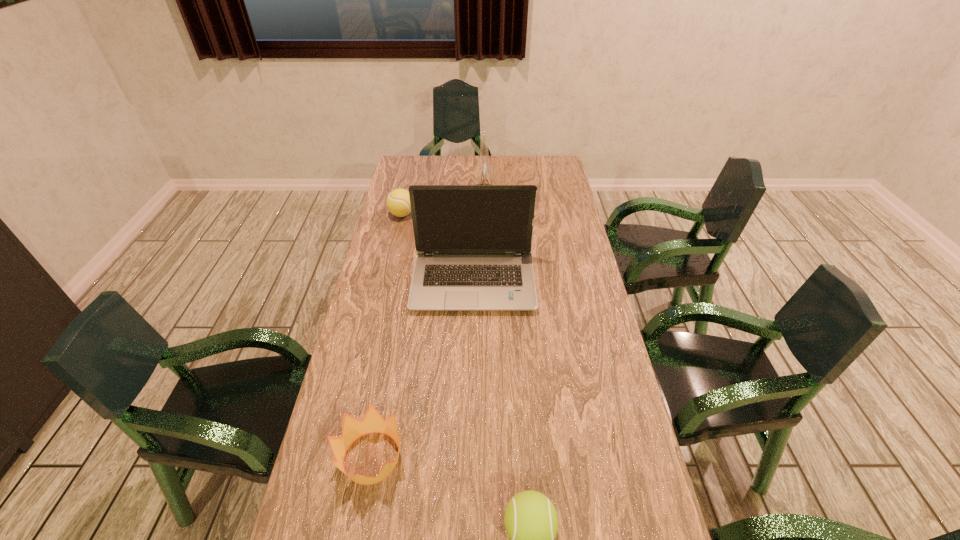
This screenshot has width=960, height=540. What are the coordinates of `oil lamp` in the screenshot? It's located at [x=484, y=174].

This screenshot has width=960, height=540. Find the location of `the third farthest object`. the third farthest object is located at coordinates (473, 242).

At what (x,y) coordinates should I click in order to perform the action: click on the left tennis ball. Please return your answer as a coordinate pair (x, y). Looking at the image, I should click on (398, 201).

At what (x,y) coordinates should I click in order to perform the action: click on crown. Please return your answer as a coordinate pair (x, y). This screenshot has height=540, width=960. Looking at the image, I should click on (352, 428).

Where is `vacant space located 0.270m on the right of the oil lamp`? vacant space located 0.270m on the right of the oil lamp is located at coordinates (566, 211).

Where is `free location located 0.120m on the screen of the third nearest object`? free location located 0.120m on the screen of the third nearest object is located at coordinates (472, 347).

Identify the location of free location located 0.300m on the right of the farther tennis ball. This screenshot has height=540, width=960. (493, 214).

Identify the location of free space located 0.070m on the right of the crown. (437, 458).

This screenshot has width=960, height=540. In order to click on laptop computer situated at the left edge in this screenshot , I will do `click(473, 242)`.

Where is `tennis ball located at the left edge`? The height and width of the screenshot is (540, 960). tennis ball located at the left edge is located at coordinates (398, 201).